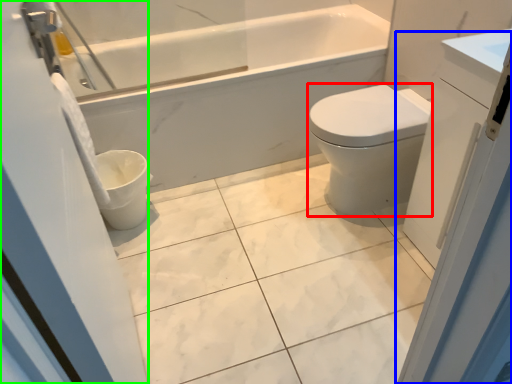
Question: Which object is the farthest from bidet (highlighted by a red box)? Choose among these: screen door (highlighted by a blue box) or screen door (highlighted by a green box).

Choices:
 (A) screen door
 (B) screen door

Answer: (B)